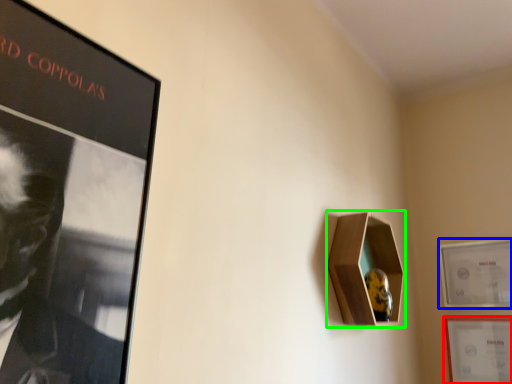
Question: Considering the real-world distances, which object is farthest from picture frame (highlighted by a red box)? picture frame (highlighted by a blue box) or cabinet (highlighted by a green box)?

Choices:
 (A) picture frame
 (B) cabinet

Answer: (B)